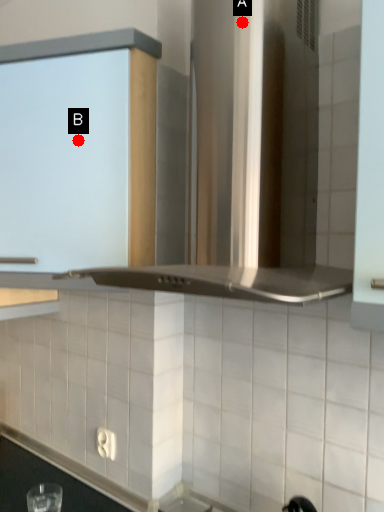
Question: Two points are circled on the image, labeled by A and B beside each circle. Which point is further to the camera?

Choices:
 (A) A is further
 (B) B is further

Answer: (B)